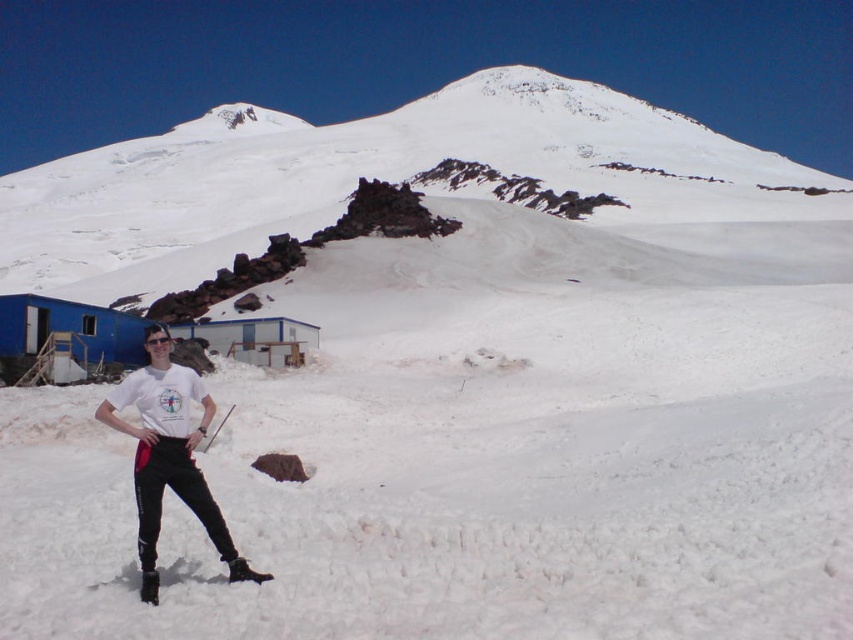
Does snowy white mountain at upper center have a smaller size compared to white matte t-shirt at lower left?

No, snowy white mountain at upper center is not smaller than white matte t-shirt at lower left.

Looking at this image, can you confirm if snowy white mountain at upper center is positioned to the left of white matte t-shirt at lower left?

Yes, snowy white mountain at upper center is to the left of white matte t-shirt at lower left.

Between point (196, 225) and point (210, 529), which one is positioned behind?

Positioned behind is point (196, 225).

Find the location of a particular element. snowy white mountain at upper center is located at coordinates (366, 177).